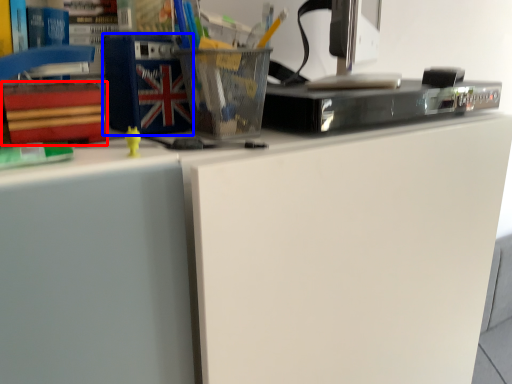
Question: Which object appears closest to the camera in this image, paperback book (highlighted by a red box) or paperback book (highlighted by a blue box)?

Choices:
 (A) paperback book
 (B) paperback book

Answer: (B)